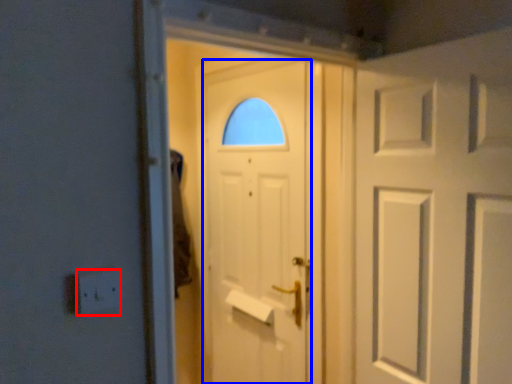
Question: Which point is further to the camera, electric outlet (highlighted by a red box) or door (highlighted by a blue box)?

Choices:
 (A) electric outlet
 (B) door

Answer: (B)